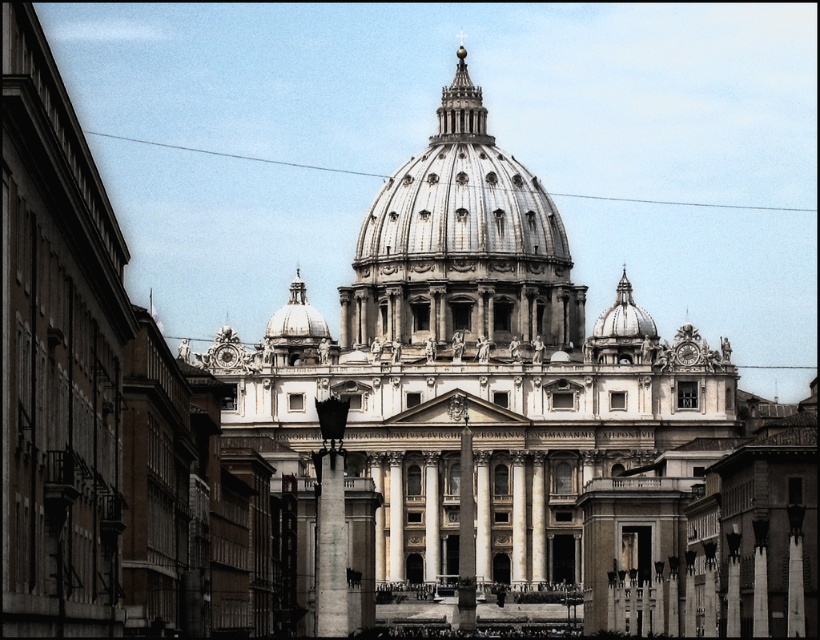
Question: Based on their relative distances, which object is farther from the smooth stone pillar at center?

Choices:
 (A) polished stone column at center
 (B) white marble church at center
 (C) matte silver dome at upper center

Answer: (C)

Question: Which of the following is the closest to the observer?

Choices:
 (A) (328, 566)
 (B) (550, 520)

Answer: (A)

Question: Can you confirm if shiny silver dome at center is positioned above smooth stone pillar at center?

Choices:
 (A) no
 (B) yes

Answer: (B)

Question: Is smooth stone pillar at center thinner than matte silver dome at upper center?

Choices:
 (A) no
 (B) yes

Answer: (B)

Question: Among these points, which one is nearest to the camera?

Choices:
 (A) (326, 573)
 (B) (485, 205)
 (C) (518, 456)
 (D) (613, 314)

Answer: (A)

Question: Can you confirm if matte silver dome at upper center is positioned below white marble pillar at center?

Choices:
 (A) no
 (B) yes

Answer: (A)